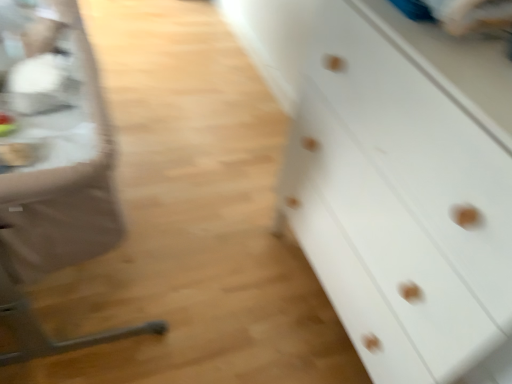
Question: Based on their positions, is metallic silver table at left located to the left or right of metallic silver feeding chair at left?

Choices:
 (A) right
 (B) left

Answer: (B)

Question: Is metallic silver table at left bigger or smaller than metallic silver feeding chair at left?

Choices:
 (A) small
 (B) big

Answer: (A)

Question: Which is farther from the white matte chest of drawers at right?

Choices:
 (A) metallic silver table at left
 (B) metallic silver feeding chair at left

Answer: (A)

Question: Which object is the farthest from the metallic silver table at left?

Choices:
 (A) white matte chest of drawers at right
 (B) metallic silver feeding chair at left

Answer: (A)